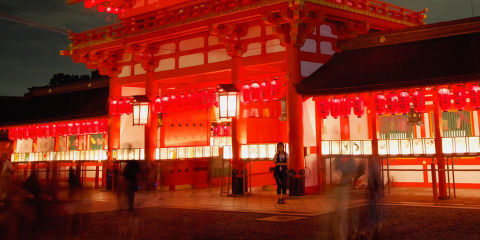
Locate an element on the screen. The height and width of the screenshot is (240, 480). windows is located at coordinates (16, 144), (45, 149), (62, 147), (86, 142), (410, 116), (458, 125).